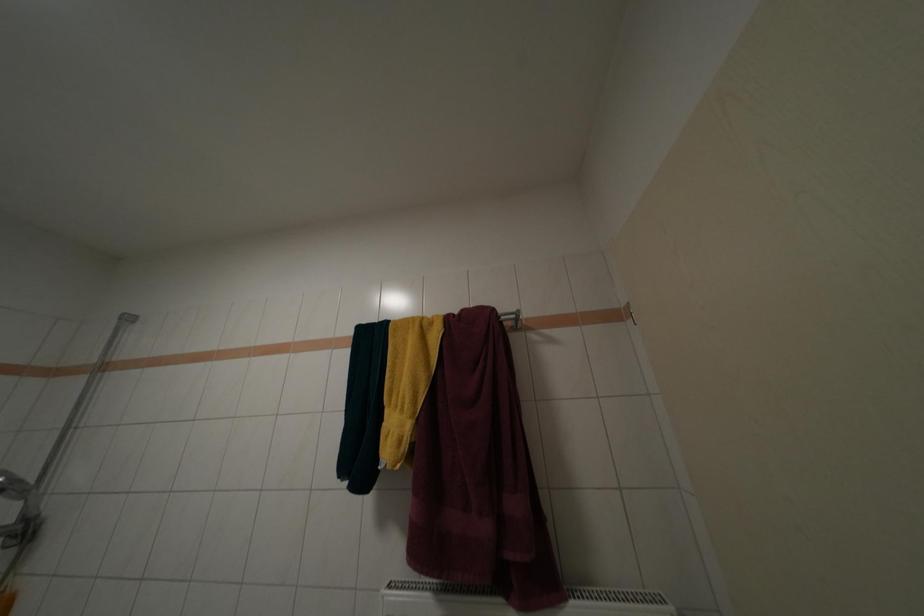
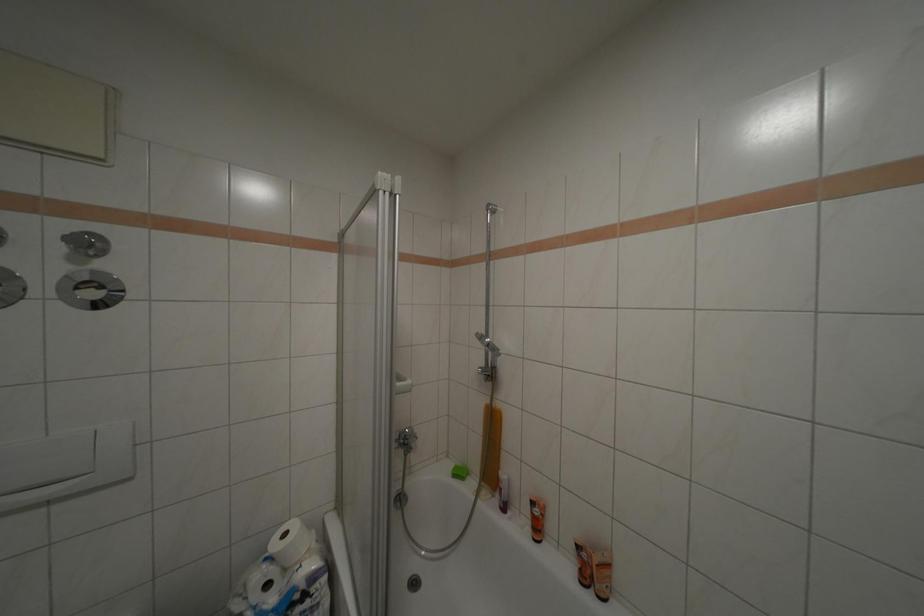
The first image is from the beginning of the video and the second image is from the end. How did the camera likely rotate when shooting the video?

The rotation direction of the camera is left-down.